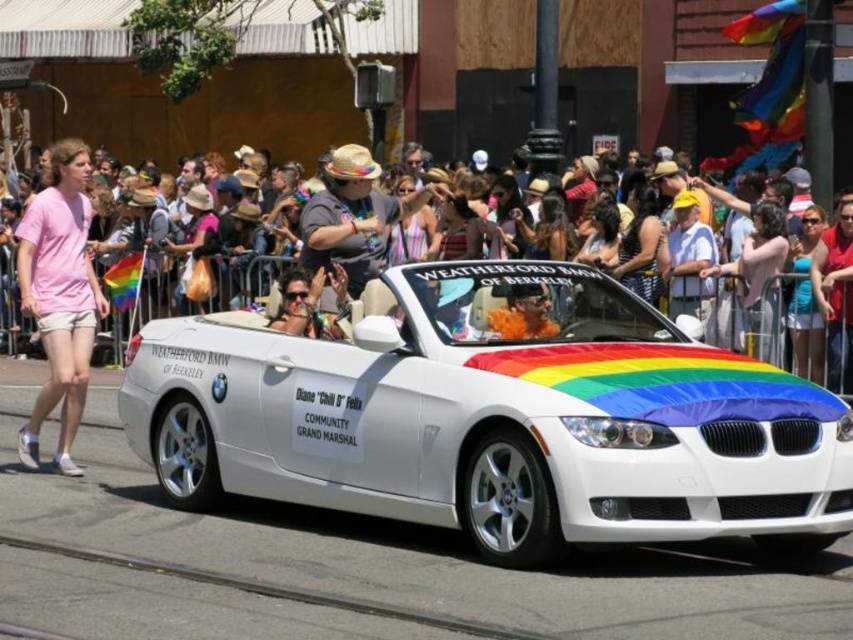
You are a photographer at the parade. You want to take a photo of both the BMW convertible and the rainbow flag on its hood. You are standing at point (521, 317). Can you see the point (36, 282) in your current line of sight?

Yes, because point (36, 282) is behind point (521, 317), so if you are at point (521, 317), you can see the point (36, 282) behind it.

You are a photographer standing on the sidewalk at the parade. You want to take a photo of both the white metallic convertible at center and the rainbow fabric crowd at center. Which object should you focus on first to ensure both are in the frame?

You should focus on the white metallic convertible at center first since it is closer to you than the rainbow fabric crowd at center, ensuring both are in the frame by adjusting the camera angle accordingly.

From the picture: You are a photographer trying to capture a photo of the rainbow fabric crowd at center and the orange fuzzy hat at center from a distance. If your camera has a minimum focus distance of 15 meters, will you be able to take a clear photo of both subjects?

The rainbow fabric crowd at center is 14.57 meters from orange fuzzy hat at center, so the distance between them is less than 15 meters. Therefore, the camera might not be able to focus on both subjects clearly if they are within the minimum focus distance requirement.